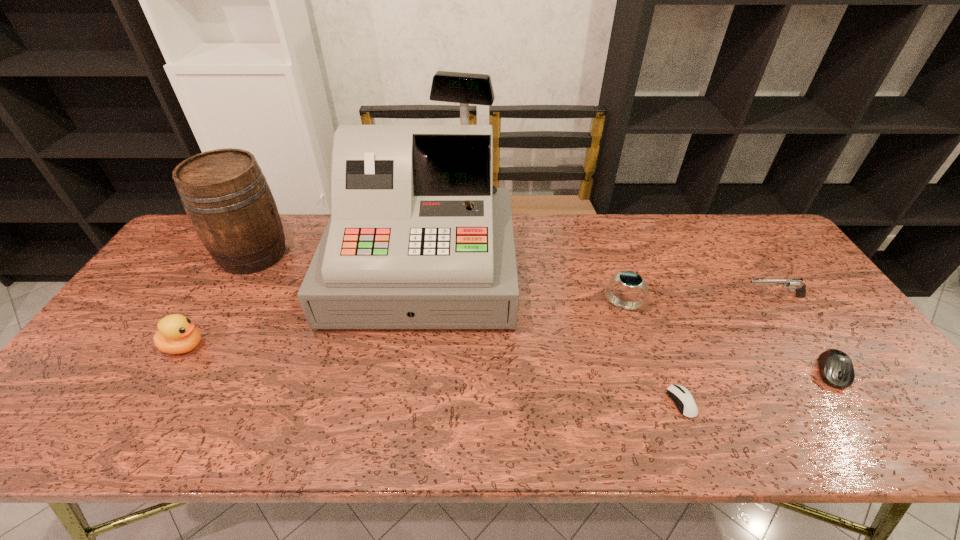
Where is `vacant space at the near left corner of the desktop`? The image size is (960, 540). vacant space at the near left corner of the desktop is located at coordinates (x=50, y=420).

Find the location of `vacant space at the far right corner`. vacant space at the far right corner is located at coordinates (756, 228).

Where is `vacant space in between the shorter mouse and the fifth tallest object`? vacant space in between the shorter mouse and the fifth tallest object is located at coordinates click(x=728, y=350).

The image size is (960, 540). Find the location of `free space between the fifth object from right to left and the sixth tallest object`. free space between the fifth object from right to left and the sixth tallest object is located at coordinates (628, 321).

Where is `free space that is in between the cider and the duckling`? The image size is (960, 540). free space that is in between the cider and the duckling is located at coordinates (219, 300).

This screenshot has height=540, width=960. I want to click on blank region between the right mouse and the second tallest object, so click(543, 313).

I want to click on free spot between the sixth tallest object and the watch, so click(x=728, y=339).

Locate an element on the screen. free space between the tallest object and the taller mouse is located at coordinates (628, 321).

Locate an element on the screen. This screenshot has height=540, width=960. free space between the fifth object from right to left and the left mouse is located at coordinates (552, 336).

Identify which object is the fifth nearest to the watch. Please provide its 2D coordinates. Your answer should be formatted as a tuple, i.e. [(x, y)], where the tuple contains the x and y coordinates of a point satisfying the conditions above.

[(228, 201)]